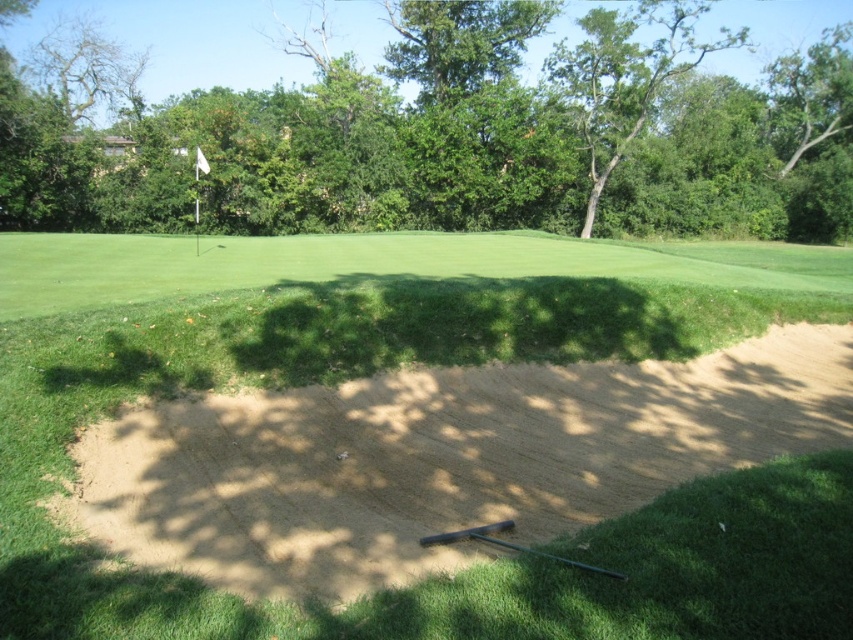
You are a golfer planning your shot and need to know which area takes up more space in the image between the green grass at center and the green leafy tree at upper center. Can you tell me?

The green leafy tree at upper center occupies more space than the green grass at center in the image.